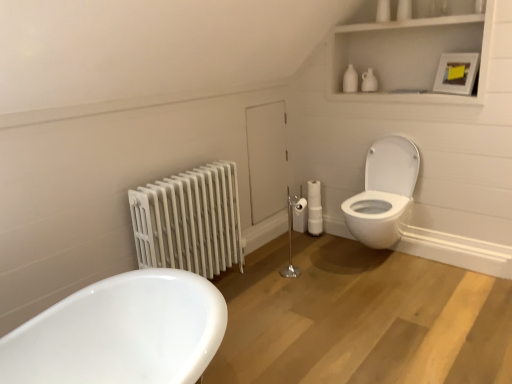
This screenshot has height=384, width=512. I want to click on silver metallic toilet paper holder at center, so click(291, 233).

Locate an element on the screen. The image size is (512, 384). white glossy toilet at right is located at coordinates [384, 193].

In order to click on silver metallic toilet paper holder at center in this screenshot , I will do pyautogui.click(x=291, y=233).

How much distance is there between white matte cabinet at upper right and white glossy toilet at right?

white matte cabinet at upper right is 64.08 centimeters away from white glossy toilet at right.

Are white matte cabinet at upper right and white glossy toilet at right located far from each other?

Actually, white matte cabinet at upper right and white glossy toilet at right are a little close together.

From the image's perspective, which one is positioned higher, white matte cabinet at upper right or white glossy toilet at right?

white matte cabinet at upper right appears higher in the image.

Does white painted metal radiator at left touch white matte cabinet at upper right?

No, white painted metal radiator at left is not with white matte cabinet at upper right.

Can you confirm if white painted metal radiator at left is bigger than white matte cabinet at upper right?

Incorrect, white painted metal radiator at left is not larger than white matte cabinet at upper right.

Does white painted metal radiator at left have a lesser height compared to white matte cabinet at upper right?

No.

From a real-world perspective, is white painted metal radiator at left beneath white matte cabinet at upper right?

Yes, from a real-world perspective, white painted metal radiator at left is beneath white matte cabinet at upper right.

How much distance is there between white painted metal radiator at left and silver metallic toilet paper holder at center?

white painted metal radiator at left and silver metallic toilet paper holder at center are 3.99 feet apart.

From the image's perspective, is white painted metal radiator at left on top of silver metallic toilet paper holder at center?

Correct, white painted metal radiator at left appears higher than silver metallic toilet paper holder at center in the image.

Is white painted metal radiator at left in front of or behind silver metallic toilet paper holder at center in the image?

white painted metal radiator at left is in front of silver metallic toilet paper holder at center.

You are a GUI agent. You are given a task and a screenshot of the screen. Output one action in this format:
    pyautogui.click(x=<x>, y=<y>)
    Task: Click on the radiator lying below the white glossy toilet at right (from the image's perspective)
    This screenshot has width=512, height=384.
    Given the screenshot: What is the action you would take?
    pyautogui.click(x=190, y=221)

Considering the relative positions of white glossy toilet at right and white painted metal radiator at left in the image provided, is white glossy toilet at right to the left of white painted metal radiator at left from the viewer's perspective?

No.

Does point (391, 135) appear closer or farther from the camera than point (178, 256)?

Point (391, 135) is farther from the camera than point (178, 256).

Could you tell me if white glossy toilet at right is turned towards white painted metal radiator at left?

No, white glossy toilet at right is not facing towards white painted metal radiator at left.

Considering the sizes of silver metallic toilet paper holder at center and white matte cabinet at upper right in the image, is silver metallic toilet paper holder at center bigger or smaller than white matte cabinet at upper right?

In the image, silver metallic toilet paper holder at center appears to be smaller than white matte cabinet at upper right.

Is silver metallic toilet paper holder at center not close to white matte cabinet at upper right?

Indeed, silver metallic toilet paper holder at center is not near white matte cabinet at upper right.

Who is more distant, silver metallic toilet paper holder at center or white matte cabinet at upper right?

silver metallic toilet paper holder at center is further from the camera.

Would you say silver metallic toilet paper holder at center contains white matte cabinet at upper right?

No, white matte cabinet at upper right is not a part of silver metallic toilet paper holder at center.

Choose the correct answer: Is silver metallic toilet paper holder at center inside white painted metal radiator at left or outside it?

silver metallic toilet paper holder at center cannot be found inside white painted metal radiator at left.

What's the angular difference between silver metallic toilet paper holder at center and white painted metal radiator at left's facing directions?

silver metallic toilet paper holder at center and white painted metal radiator at left are facing 15.3 degrees away from each other.

Is silver metallic toilet paper holder at center positioned with its back to white painted metal radiator at left?

Yes.

Is the surface of silver metallic toilet paper holder at center in direct contact with white painted metal radiator at left?

There is a gap between silver metallic toilet paper holder at center and white painted metal radiator at left.

Are white glossy toilet at right and white matte cabinet at upper right making contact?

white glossy toilet at right and white matte cabinet at upper right are clearly separated.

Would you say white matte cabinet at upper right is part of white glossy toilet at right's contents?

No, white matte cabinet at upper right is located outside of white glossy toilet at right.

Locate an element on the screen. The image size is (512, 384). toilet below the white matte cabinet at upper right (from the image's perspective) is located at coordinates (384, 193).

Where is `medicine cabinet located above the white painted metal radiator at left (from the image's perspective)`? medicine cabinet located above the white painted metal radiator at left (from the image's perspective) is located at coordinates (408, 56).

Looking at this image, based on their spatial positions, is silver metallic toilet paper holder at center or white matte cabinet at upper right further from white glossy toilet at right?

Based on the image, silver metallic toilet paper holder at center appears to be further to white glossy toilet at right.

From the image, which object appears to be nearer to white painted metal radiator at left, silver metallic toilet paper holder at center or white matte cabinet at upper right?

silver metallic toilet paper holder at center.

Which object lies further to the anchor point silver metallic toilet paper holder at center, white glossy toilet at right or white painted metal radiator at left?

Based on the image, white painted metal radiator at left appears to be further to silver metallic toilet paper holder at center.

When comparing their distances from white glossy toilet at right, does white painted metal radiator at left or white matte cabinet at upper right seem further?

Based on the image, white painted metal radiator at left appears to be further to white glossy toilet at right.

Looking at the image, which one is located closer to silver metallic toilet paper holder at center, white glossy toilet at right or white matte cabinet at upper right?

The object closer to silver metallic toilet paper holder at center is white glossy toilet at right.

From the image, which object appears to be nearer to white matte cabinet at upper right, silver metallic toilet paper holder at center or white glossy toilet at right?

The object closer to white matte cabinet at upper right is white glossy toilet at right.

Estimate the real-world distances between objects in this image. Which object is further from white painted metal radiator at left, silver metallic toilet paper holder at center or white glossy toilet at right?

silver metallic toilet paper holder at center is positioned further to the anchor white painted metal radiator at left.

Estimate the real-world distances between objects in this image. Which object is further from white matte cabinet at upper right, white glossy toilet at right or silver metallic toilet paper holder at center?

Based on the image, silver metallic toilet paper holder at center appears to be further to white matte cabinet at upper right.

Where is `shower located between white painted metal radiator at left and white glossy toilet at right in the left-right direction`? This screenshot has height=384, width=512. shower located between white painted metal radiator at left and white glossy toilet at right in the left-right direction is located at coordinates (291, 233).

Where is `radiator between white matte cabinet at upper right and silver metallic toilet paper holder at center from top to bottom`? radiator between white matte cabinet at upper right and silver metallic toilet paper holder at center from top to bottom is located at coordinates (190, 221).

Locate an element on the screen. This screenshot has width=512, height=384. toilet that lies between white matte cabinet at upper right and silver metallic toilet paper holder at center from top to bottom is located at coordinates (384, 193).

At what (x,y) coordinates should I click in order to perform the action: click on toilet between white painted metal radiator at left and white matte cabinet at upper right. Please return your answer as a coordinate pair (x, y). The height and width of the screenshot is (384, 512). Looking at the image, I should click on (384, 193).